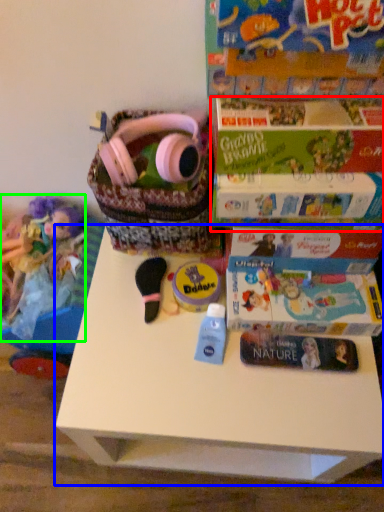
Question: Based on their relative distances, which object is farther from paperback book (highlighted by a red box)? Choose from table (highlighted by a blue box) and doll (highlighted by a green box).

Choices:
 (A) table
 (B) doll

Answer: (B)